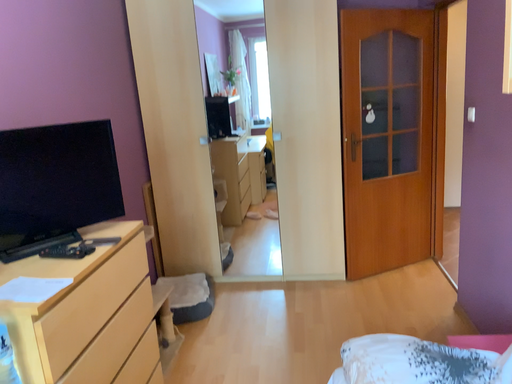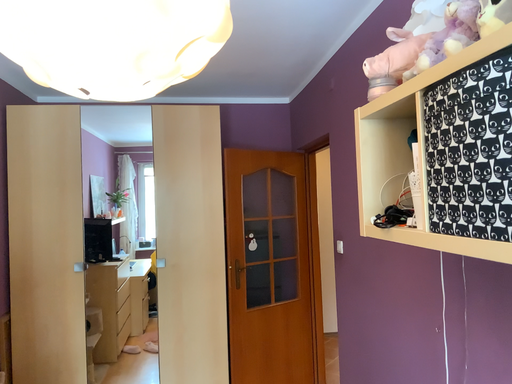
Question: Which way did the camera rotate in the video?

Choices:
 (A) rotated upward
 (B) rotated downward

Answer: (A)